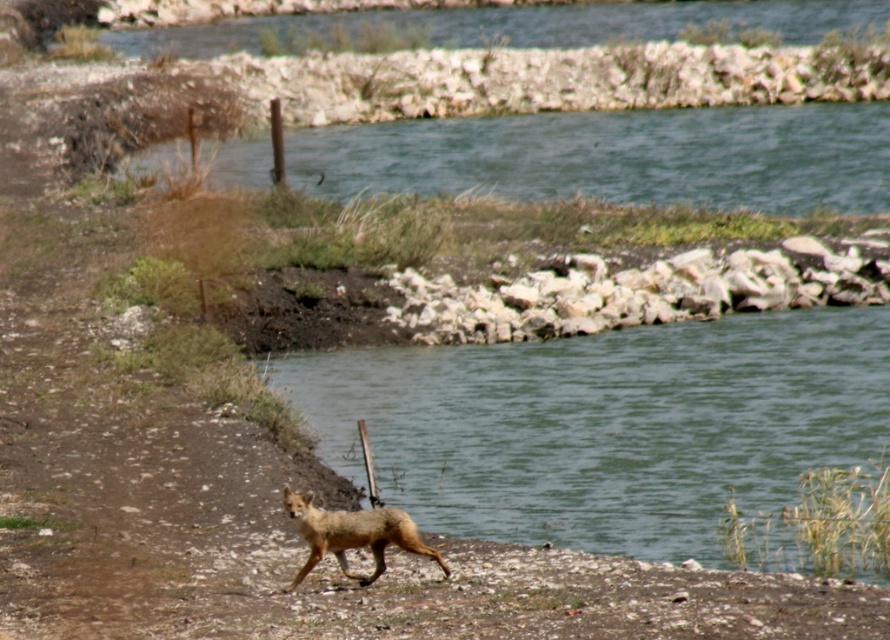
Question: Can you confirm if greenish-blue water at upper center is positioned to the left of fur-like golden coyote at lower center?

Choices:
 (A) no
 (B) yes

Answer: (A)

Question: Can you confirm if greenish-blue water at upper center is positioned to the left of fur-like golden coyote at lower center?

Choices:
 (A) yes
 (B) no

Answer: (B)

Question: Which object appears farthest from the camera in this image?

Choices:
 (A) fur-like golden coyote at lower center
 (B) greenish-blue water at upper center
 (C) green water at center

Answer: (B)

Question: Which object is the closest to the green water at center?

Choices:
 (A) fur-like golden coyote at lower center
 (B) greenish-blue water at upper center

Answer: (A)

Question: Considering the relative positions of green water at center and fur-like golden coyote at lower center in the image provided, where is green water at center located with respect to fur-like golden coyote at lower center?

Choices:
 (A) below
 (B) above

Answer: (B)

Question: Which point is farther to the camera?

Choices:
 (A) greenish-blue water at upper center
 (B) green water at center

Answer: (A)